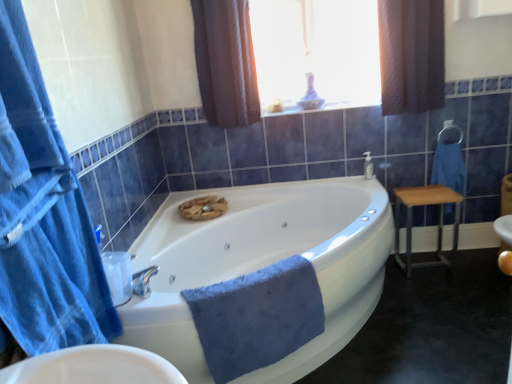
The height and width of the screenshot is (384, 512). In order to click on blank space to the left of silver metallic faucet at upper right in this screenshot , I will do `click(354, 177)`.